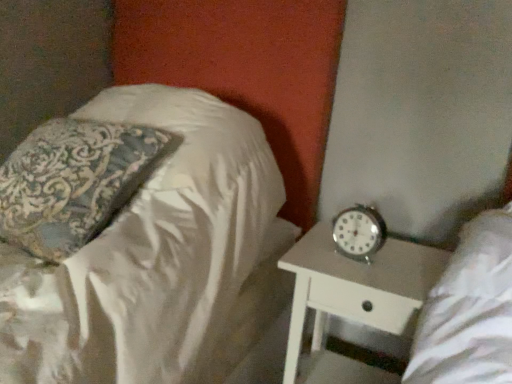
Find the location of a particular element. The height and width of the screenshot is (384, 512). spots to the right of metallic silver clock at right is located at coordinates [x=408, y=255].